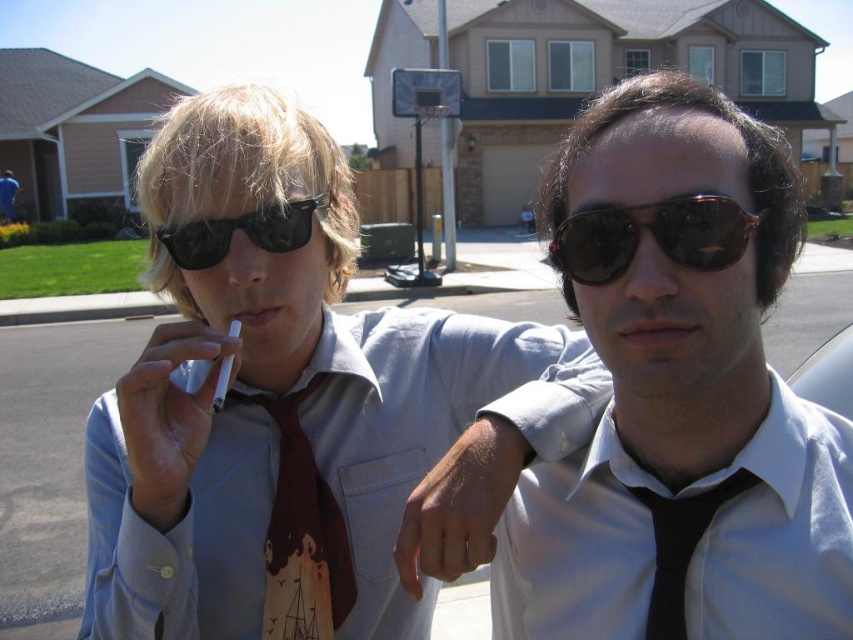
Question: Which point is farther to the camera?

Choices:
 (A) white smooth dress shirt at center
 (B) matte skin at center
 (C) black matte tie at center

Answer: (A)

Question: In this image, where is matte skin at center located relative to white matte cigarette at center?

Choices:
 (A) right
 (B) left

Answer: (A)

Question: Estimate the real-world distances between objects in this image. Which object is farther from the matte skin at center?

Choices:
 (A) black satin tie at center
 (B) white matte cigarette at center

Answer: (B)

Question: Can you confirm if white smooth dress shirt at center is positioned to the left of browntextured fabrictie at center?

Choices:
 (A) yes
 (B) no

Answer: (B)

Question: Does white smooth dress shirt at center come behind black reflective sunglasses at upper left?

Choices:
 (A) yes
 (B) no

Answer: (B)

Question: Which object appears closest to the camera in this image?

Choices:
 (A) black satin tie at center
 (B) light blue cotton dress shirt at center
 (C) tortoiseshell sunglasses at center

Answer: (C)